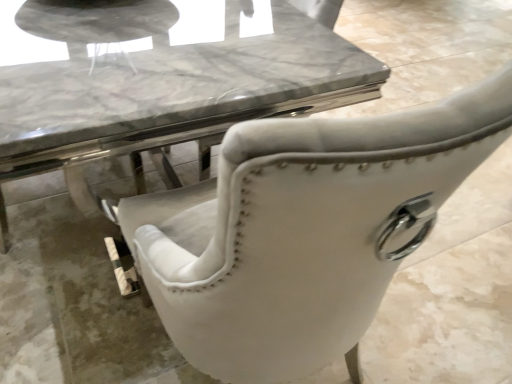
Where is `white leather chair at center`? white leather chair at center is located at coordinates (x=303, y=230).

What do you see at coordinates (303, 230) in the screenshot?
I see `white leather chair at center` at bounding box center [303, 230].

The image size is (512, 384). What are the coordinates of `white leather chair at center` in the screenshot? It's located at (303, 230).